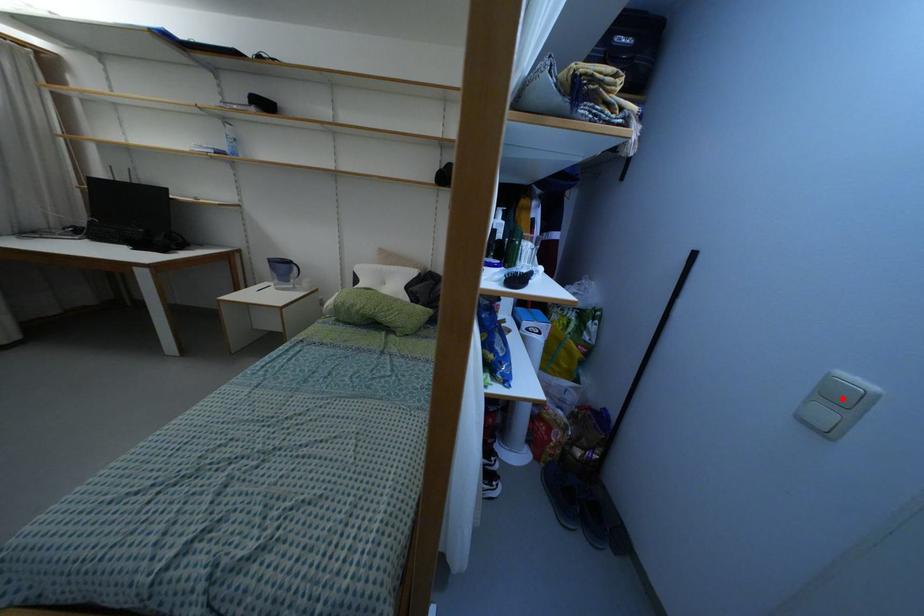
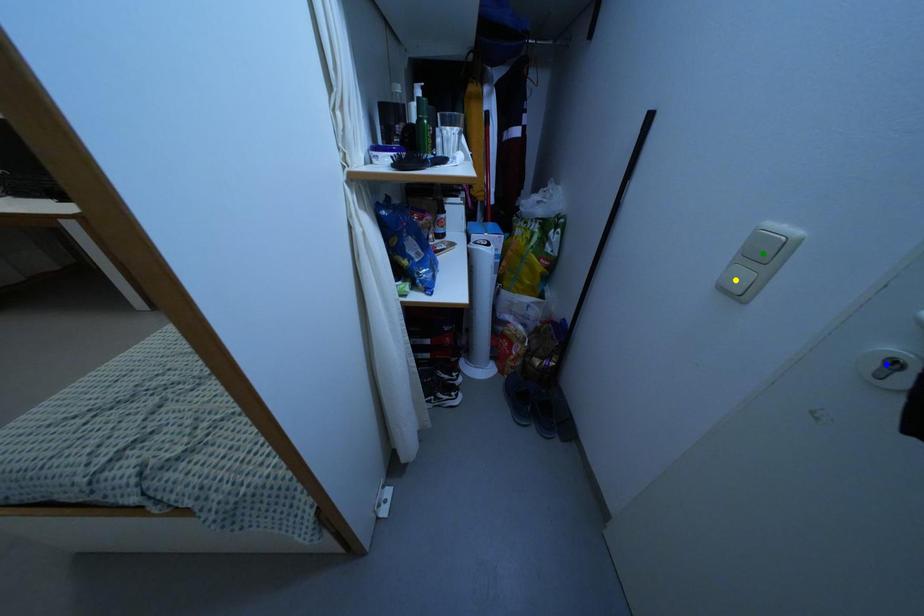
Question: I am providing you with two images of the same scene from different viewpoints. A red point is marked on the first image. You are given multiple points on the second image. Which point in image 2 represents the same 3d spot as the red point in image 1?

Choices:
 (A) blue point
 (B) yellow point
 (C) green point

Answer: (C)